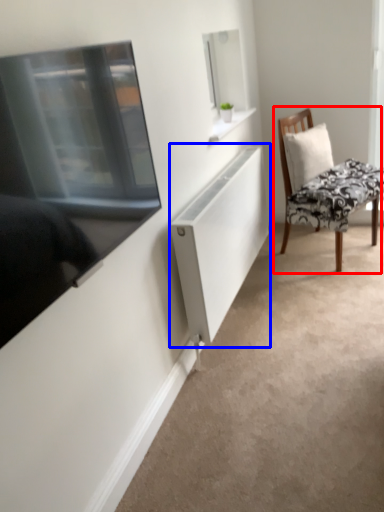
Question: Among these objects, which one is nearest to the camera, chair (highlighted by a red box) or cabinet (highlighted by a blue box)?

Choices:
 (A) chair
 (B) cabinet

Answer: (B)